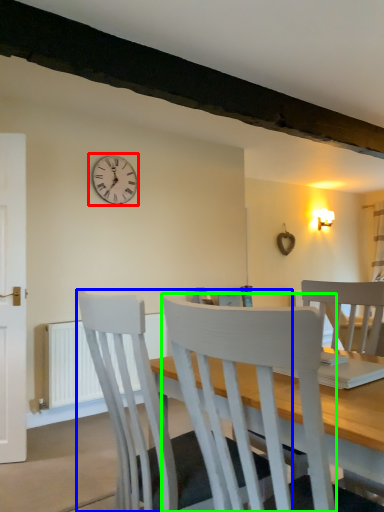
Question: Which object is positioned farthest from wall clock (highlighted by a red box)? Select from chair (highlighted by a blue box) and chair (highlighted by a green box).

Choices:
 (A) chair
 (B) chair

Answer: (B)